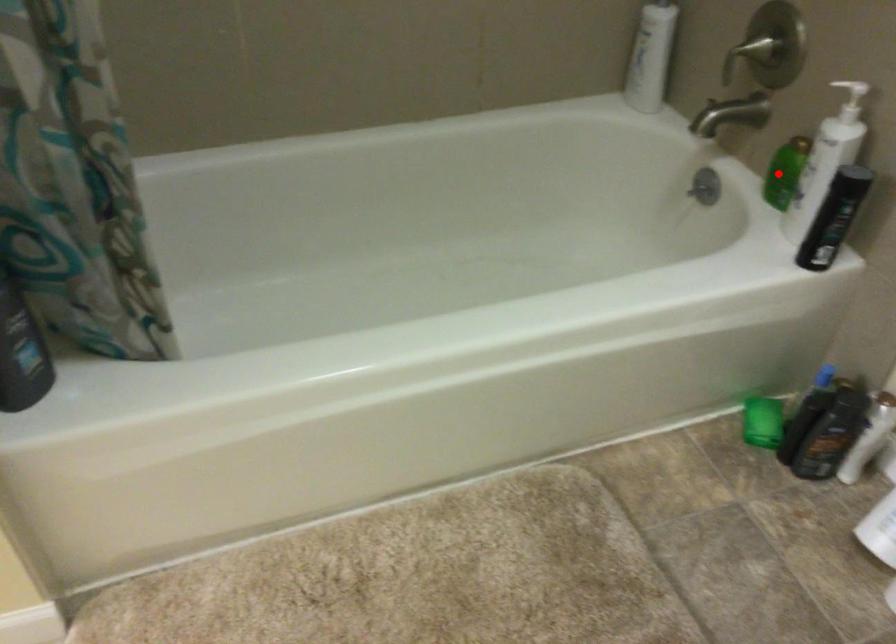
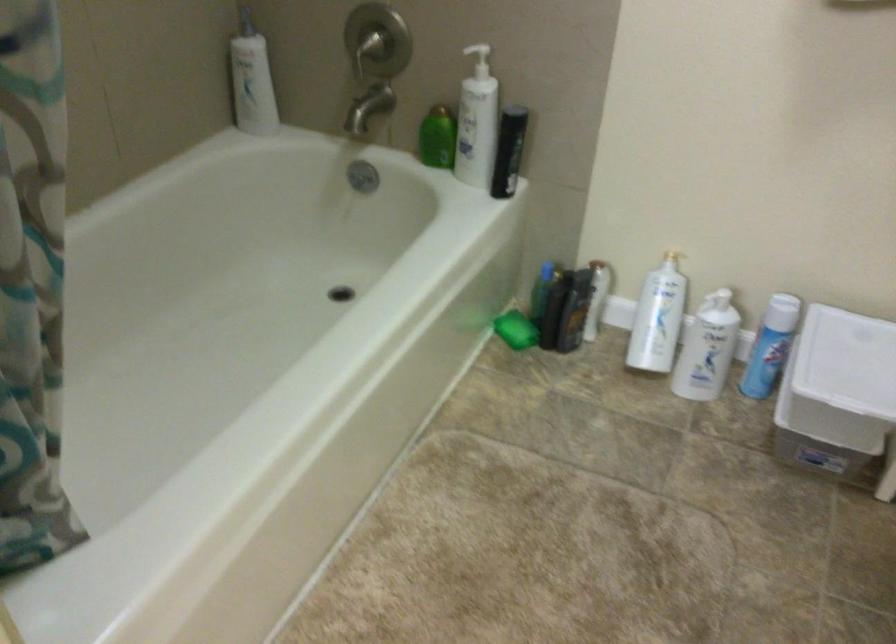
The point at the highlighted location is marked in the first image. Where is the corresponding point in the second image?

(437, 138)